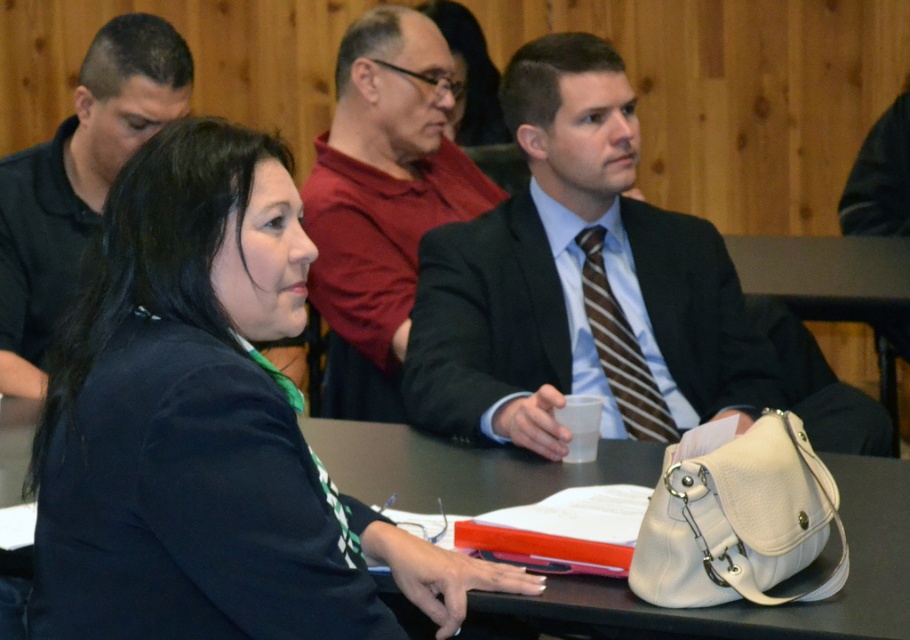
Which of these two, black fabric jacket at center or matte black suit at center, stands shorter?

black fabric jacket at center is shorter.

Is black fabric jacket at center bigger than matte black suit at center?

No, black fabric jacket at center is not bigger than matte black suit at center.

From the picture: Who is more distant from viewer, (174, 346) or (553, 136)?

Positioned behind is point (553, 136).

Locate an element on the screen. black fabric jacket at center is located at coordinates [x=207, y=428].

Can you confirm if matte black suit at center is positioned to the right of white leather handbag at lower center?

Correct, you'll find matte black suit at center to the right of white leather handbag at lower center.

This screenshot has width=910, height=640. I want to click on matte black suit at center, so click(579, 284).

Find the location of `matte black suit at center`. matte black suit at center is located at coordinates (579, 284).

Which is more to the right, dark blue suit at center or white leather handbag at lower center?

Positioned to the right is dark blue suit at center.

I want to click on dark blue suit at center, so click(x=499, y=320).

The width and height of the screenshot is (910, 640). I want to click on dark blue suit at center, so click(499, 320).